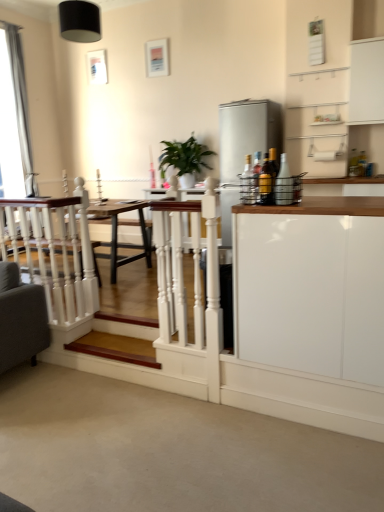
Question: Is white glossy cabinet at right, the 1th cabinetry positioned from the bottom, with green glossy plant at center?

Choices:
 (A) no
 (B) yes

Answer: (A)

Question: Is white glossy cabinet at right, placed as the 1th cabinetry when sorted from left to right, surrounding green glossy plant at center?

Choices:
 (A) no
 (B) yes

Answer: (A)

Question: Is white glossy cabinet at right, the first cabinetry viewed from the front, to the left of green glossy plant at center from the viewer's perspective?

Choices:
 (A) yes
 (B) no

Answer: (B)

Question: Does white glossy cabinet at right, marked as the 2th cabinetry in a top-to-bottom arrangement, have a greater height compared to green glossy plant at center?

Choices:
 (A) yes
 (B) no

Answer: (A)

Question: From the image's perspective, is white glossy cabinet at right, marked as the 2th cabinetry in a top-to-bottom arrangement, located above green glossy plant at center?

Choices:
 (A) yes
 (B) no

Answer: (B)

Question: Looking at their shapes, would you say green glossy plant at center is wider or thinner than wooden step at lower left?

Choices:
 (A) thin
 (B) wide

Answer: (B)

Question: Which is correct: green glossy plant at center is inside wooden step at lower left, or outside of it?

Choices:
 (A) outside
 (B) inside

Answer: (A)

Question: Is green glossy plant at center taller or shorter than wooden step at lower left?

Choices:
 (A) tall
 (B) short

Answer: (A)

Question: Is point (180, 158) positioned closer to the camera than point (125, 323)?

Choices:
 (A) closer
 (B) farther

Answer: (B)

Question: From a real-world perspective, is metallic gold bottle at right, arranged as the 2th bottle when viewed from the left, positioned above or below translucent glass bottle at right, acting as the third bottle starting from the left?

Choices:
 (A) below
 (B) above

Answer: (B)

Question: In terms of size, does metallic gold bottle at right, arranged as the 2th bottle when viewed from the left, appear bigger or smaller than translucent glass bottle at right, acting as the third bottle starting from the left?

Choices:
 (A) big
 (B) small

Answer: (A)

Question: From their relative heights in the image, would you say metallic gold bottle at right, which is the 2th bottle in right-to-left order, is taller or shorter than translucent glass bottle at right, acting as the third bottle starting from the left?

Choices:
 (A) short
 (B) tall

Answer: (A)

Question: Looking at their shapes, would you say metallic gold bottle at right, which is the 2th bottle in right-to-left order, is wider or thinner than translucent glass bottle at right, the first bottle when ordered from right to left?

Choices:
 (A) wide
 (B) thin

Answer: (A)

Question: From a real-world perspective, is silver metallic curtain at left above or below white glossy cabinet at upper right, acting as the 1th cabinetry starting from the right?

Choices:
 (A) above
 (B) below

Answer: (A)

Question: From their relative heights in the image, would you say silver metallic curtain at left is taller or shorter than white glossy cabinet at upper right, which is the 2th cabinetry from front to back?

Choices:
 (A) short
 (B) tall

Answer: (B)